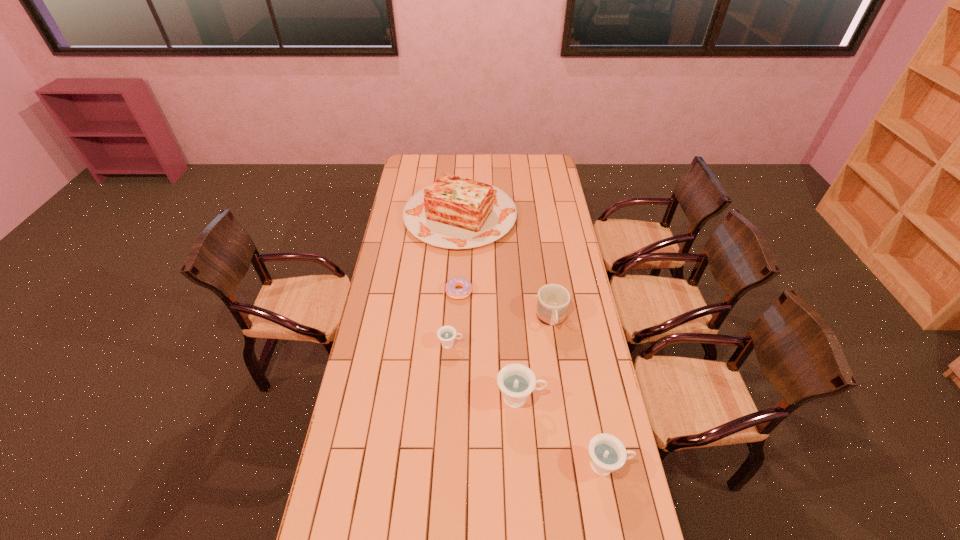
The image size is (960, 540). I want to click on vacant space at the left edge of the desktop, so click(x=394, y=374).

The image size is (960, 540). In the image, there is a desktop. In order to click on vacant space at the right edge in this screenshot , I will do `click(605, 397)`.

This screenshot has width=960, height=540. Find the location of `vacant space at the far left corner of the desktop`. vacant space at the far left corner of the desktop is located at coordinates (420, 160).

Locate an element on the screen. Image resolution: width=960 pixels, height=540 pixels. free region at the near left corner of the desktop is located at coordinates (376, 528).

Locate an element on the screen. empty location between the mug and the fifth nearest object is located at coordinates (505, 306).

Find the location of a particular element. The image size is (960, 540). vacant area between the second farthest teacup and the lasagna is located at coordinates (491, 307).

At what (x,y) coordinates should I click in order to perform the action: click on vacant area that lies between the mug and the nearest teacup. Please return your answer as a coordinate pair (x, y). This screenshot has height=540, width=960. Looking at the image, I should click on (579, 392).

This screenshot has height=540, width=960. I want to click on free spot between the second teacup from left to right and the shortest teacup, so click(486, 371).

Locate an element on the screen. This screenshot has height=540, width=960. vacant space that's between the tallest object and the mug is located at coordinates (506, 268).

Where is `vacant area between the fifth nearest object and the mug`? Image resolution: width=960 pixels, height=540 pixels. vacant area between the fifth nearest object and the mug is located at coordinates (505, 306).